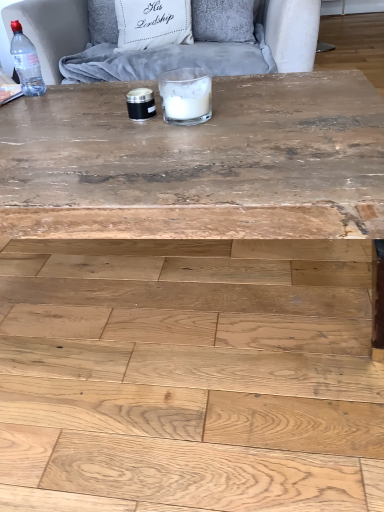
Question: Do you think transparent plastic bottle at top left is within natural wood plywood at lower center, or outside of it?

Choices:
 (A) inside
 (B) outside

Answer: (B)

Question: Looking at their shapes, would you say transparent plastic bottle at top left is wider or thinner than natural wood plywood at lower center?

Choices:
 (A) wide
 (B) thin

Answer: (B)

Question: Estimate the real-world distances between objects in this image. Which object is closer to the transparent plastic bottle at top left?

Choices:
 (A) velvet grey armchair at upper center
 (B) wooden coffee table at center
 (C) white glass candle at center
 (D) white fabric pillow at upper center
 (E) natural wood plywood at lower center

Answer: (A)

Question: Estimate the real-world distances between objects in this image. Which object is closer to the white fabric pillow at upper center?

Choices:
 (A) wooden coffee table at center
 (B) natural wood plywood at lower center
 (C) velvet grey armchair at upper center
 (D) white glass candle at center
 (E) transparent plastic bottle at top left

Answer: (C)